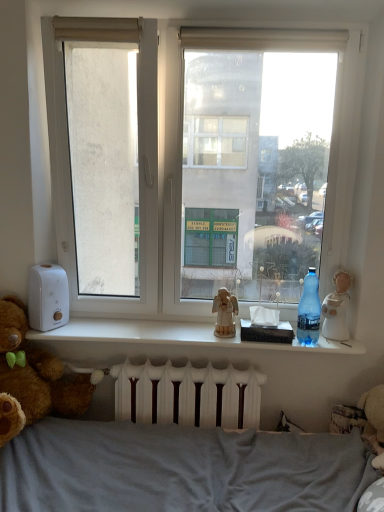
The height and width of the screenshot is (512, 384). Identify the location of free area below transparent glass window at center (from a real-world perspective). (148, 326).